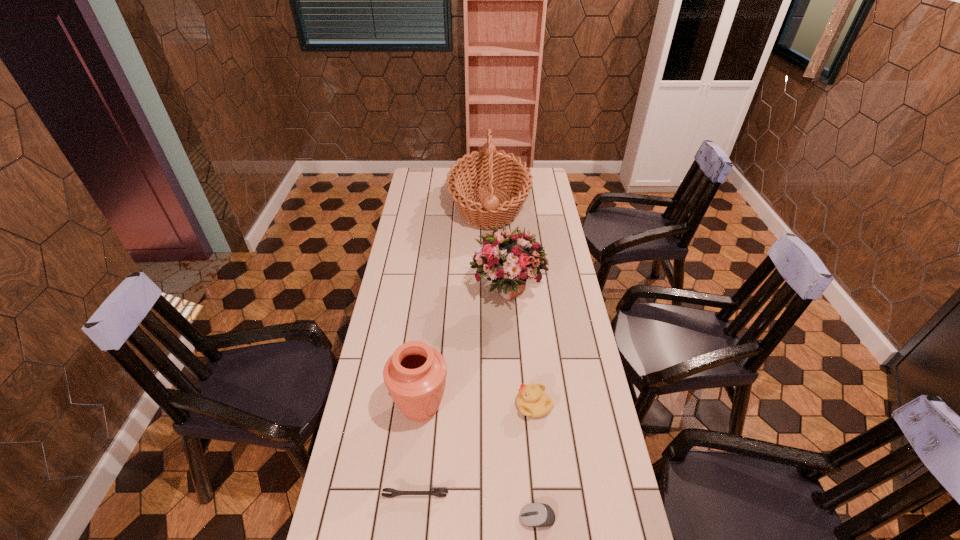
Locate an element on the screen. The width and height of the screenshot is (960, 540). free space between the vase and the shortest object is located at coordinates (479, 463).

The height and width of the screenshot is (540, 960). Identify the location of unoccupied position between the shortest object and the third shortest object. (536, 462).

Image resolution: width=960 pixels, height=540 pixels. Identify the location of vacant area between the fourth tallest object and the second shortest object. (474, 451).

Find the location of `free space between the shortest object and the tallest object`. free space between the shortest object and the tallest object is located at coordinates (514, 362).

At what (x,y) coordinates should I click in order to perform the action: click on free space between the computer equipment and the duckling. Please return your answer as a coordinate pair (x, y). Looking at the image, I should click on (536, 462).

I want to click on vacant area that lies between the vase and the farthest object, so click(455, 307).

Find the location of a particular element. This screenshot has width=960, height=540. vacant area that lies between the computer equipment and the tallest object is located at coordinates (514, 362).

This screenshot has width=960, height=540. What are the coordinates of `vacant area that lies between the basket and the fifth tallest object` in the screenshot? It's located at (452, 351).

This screenshot has width=960, height=540. I want to click on free space between the shortest object and the basket, so click(514, 362).

Where is `object that stands as the fifth closest to the second nearest object`? object that stands as the fifth closest to the second nearest object is located at coordinates (490, 167).